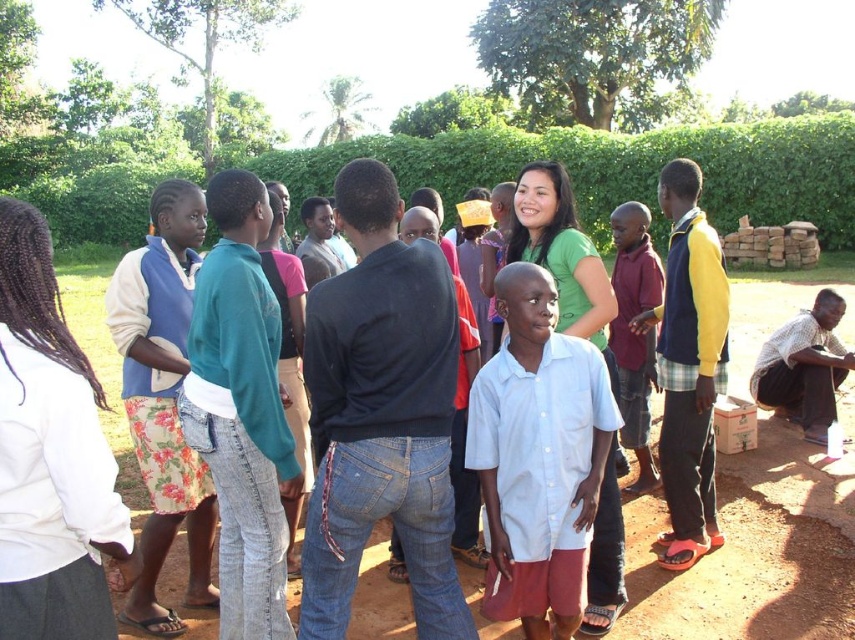
Question: Which object is farther from the camera taking this photo?

Choices:
 (A) teal denim jeans at center
 (B) floral skirt at left
 (C) white cotton shirt at center

Answer: (B)

Question: Can you confirm if white cotton shirt at center is smaller than floral skirt at left?

Choices:
 (A) yes
 (B) no

Answer: (B)

Question: Among these objects, which one is nearest to the camera?

Choices:
 (A) teal denim jeans at center
 (B) floral skirt at left

Answer: (A)

Question: Can you confirm if teal denim jeans at center is smaller than floral skirt at left?

Choices:
 (A) no
 (B) yes

Answer: (A)

Question: Does white cotton shirt at center have a lesser width compared to floral skirt at left?

Choices:
 (A) no
 (B) yes

Answer: (A)

Question: Which of these objects is positioned farthest from the floral skirt at left?

Choices:
 (A) teal denim jeans at center
 (B) white cotton shirt at center

Answer: (B)